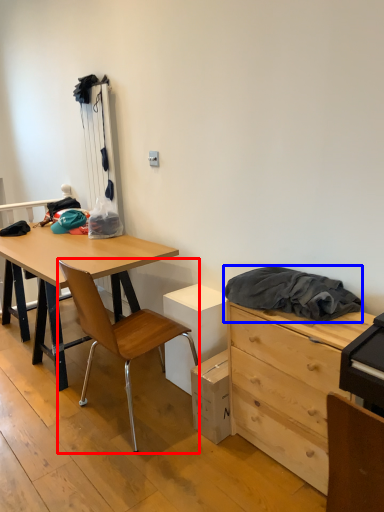
Question: Which object is closer to the camera taking this photo, chair (highlighted by a red box) or clothing (highlighted by a blue box)?

Choices:
 (A) chair
 (B) clothing

Answer: (B)